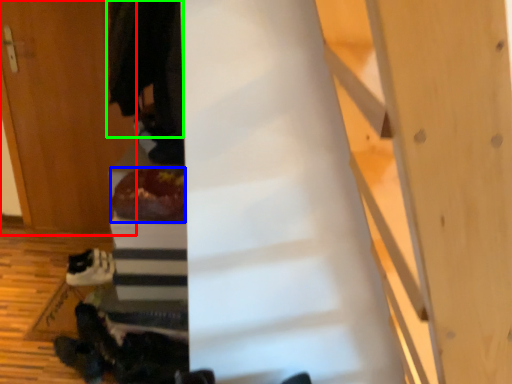
Question: Considering the real-world distances, which object is farthest from door (highlighted by a red box)? food (highlighted by a blue box) or robe (highlighted by a green box)?

Choices:
 (A) food
 (B) robe

Answer: (A)